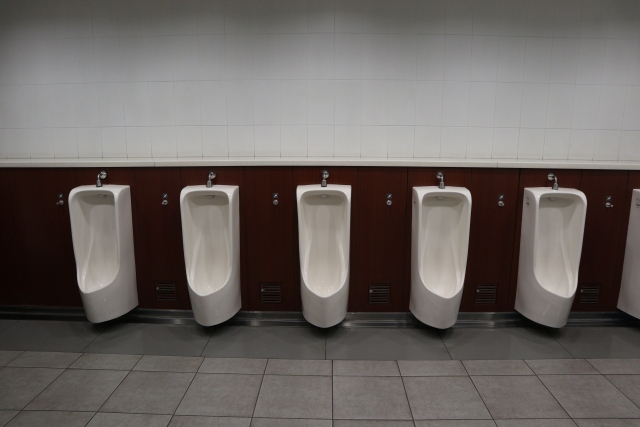
Where is `vents between urinals`? vents between urinals is located at coordinates (166, 294), (269, 292), (384, 290), (484, 295), (596, 300).